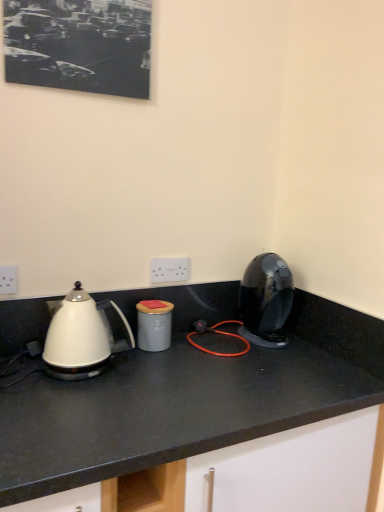
Find the location of `free space to the right of white glossy kettle at left`. free space to the right of white glossy kettle at left is located at coordinates (162, 374).